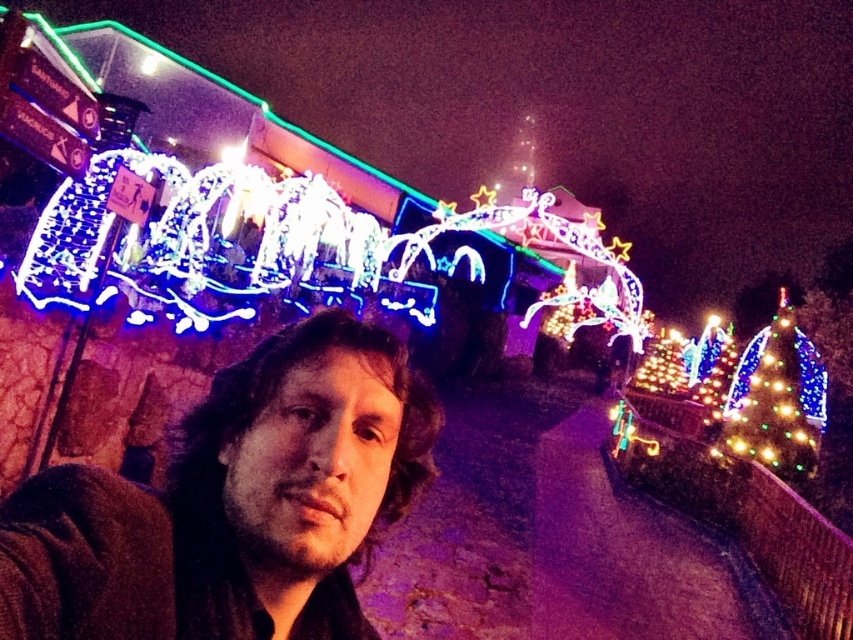
Is matte black jacket at center further to camera compared to multicolored lights at right?

No, it is not.

Is matte black jacket at center positioned in front of multicolored lights at right?

Yes, it is.

Who is more forward, (277,445) or (805,369)?

Point (277,445) is in front.

What are the coordinates of `matte black jacket at center` in the screenshot? It's located at (233, 502).